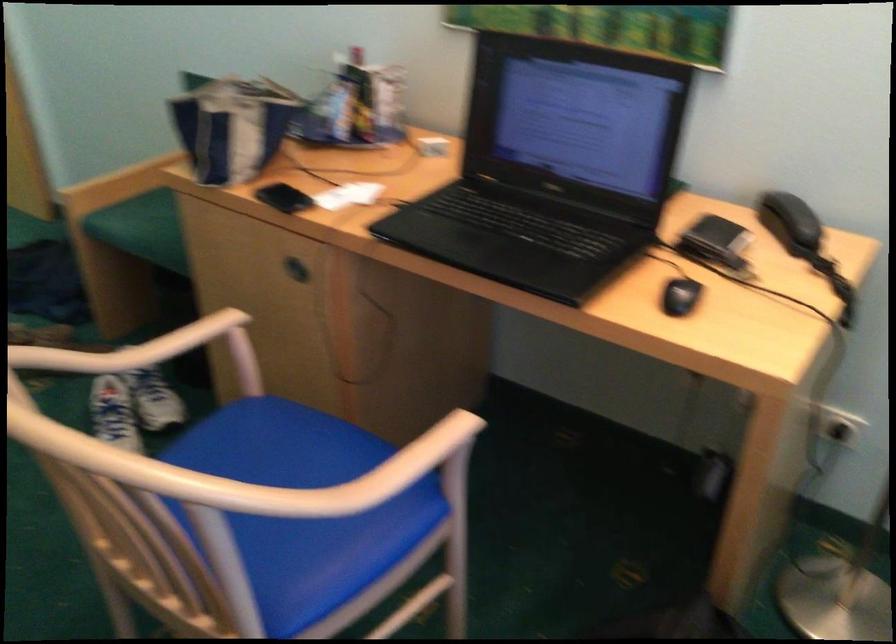
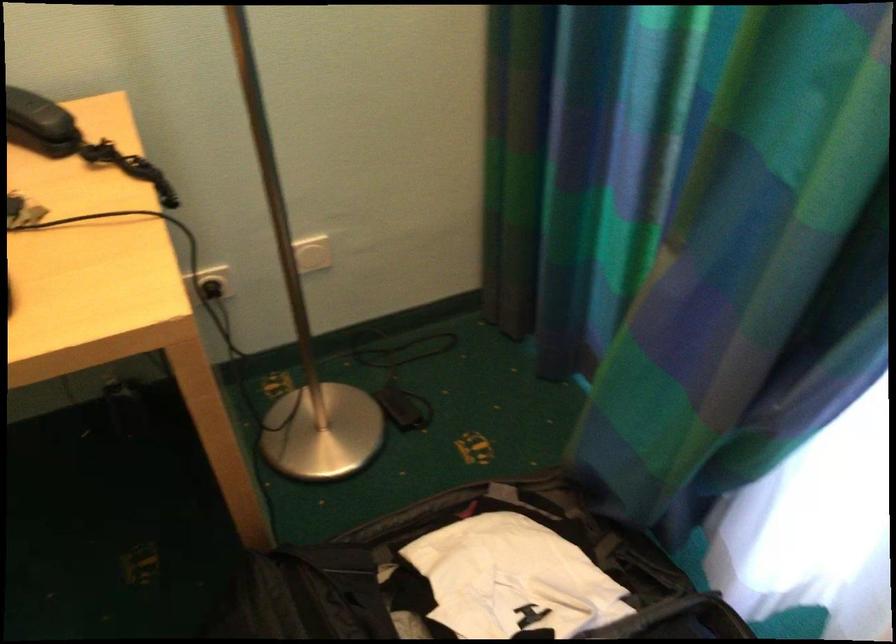
In the second image, find the point that corresponds to (803,222) in the first image.

(40, 122)